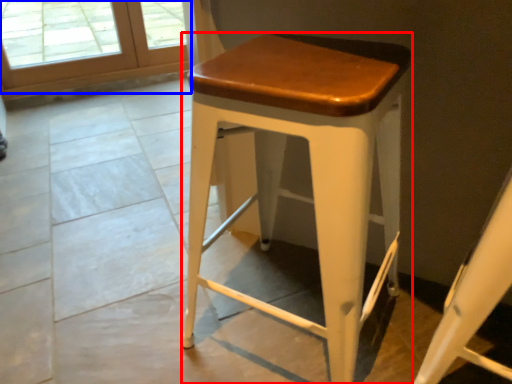
Question: Which object appears closest to the camera in this image, stool (highlighted by a red box) or screen door (highlighted by a blue box)?

Choices:
 (A) stool
 (B) screen door

Answer: (A)